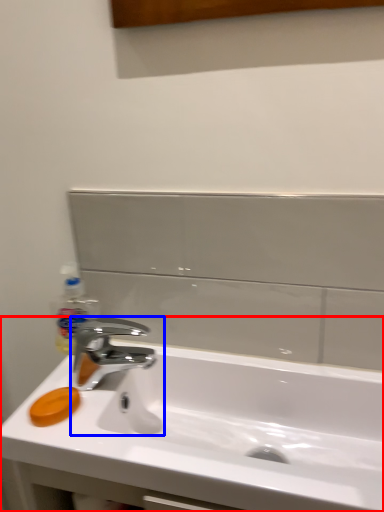
Question: Which object is closer to the camera taking this photo, sink (highlighted by a red box) or tap (highlighted by a blue box)?

Choices:
 (A) sink
 (B) tap

Answer: (A)